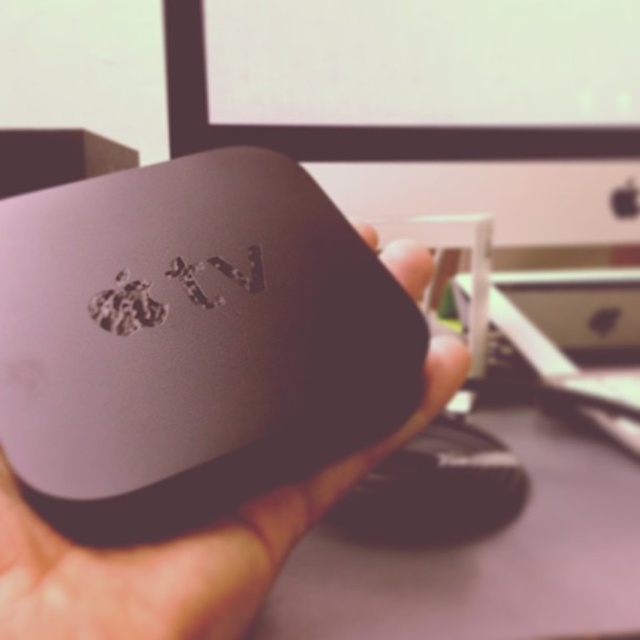
Is matte gray apple tv at center below black matte mouse at center?

Incorrect, matte gray apple tv at center is not positioned below black matte mouse at center.

This screenshot has width=640, height=640. I want to click on matte gray apple tv at center, so coord(180,550).

Find the location of a particular element. matte gray apple tv at center is located at coordinates (180, 550).

This screenshot has height=640, width=640. Identify the location of matte gray apple tv at center. (180, 550).